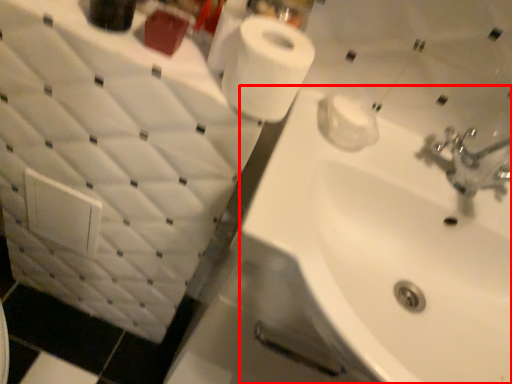
Question: From the image's perspective, considering the relative positions of sink (annotated by the red box) and toilet paper in the image provided, where is sink (annotated by the red box) located with respect to the staircase?

Choices:
 (A) below
 (B) above

Answer: (A)